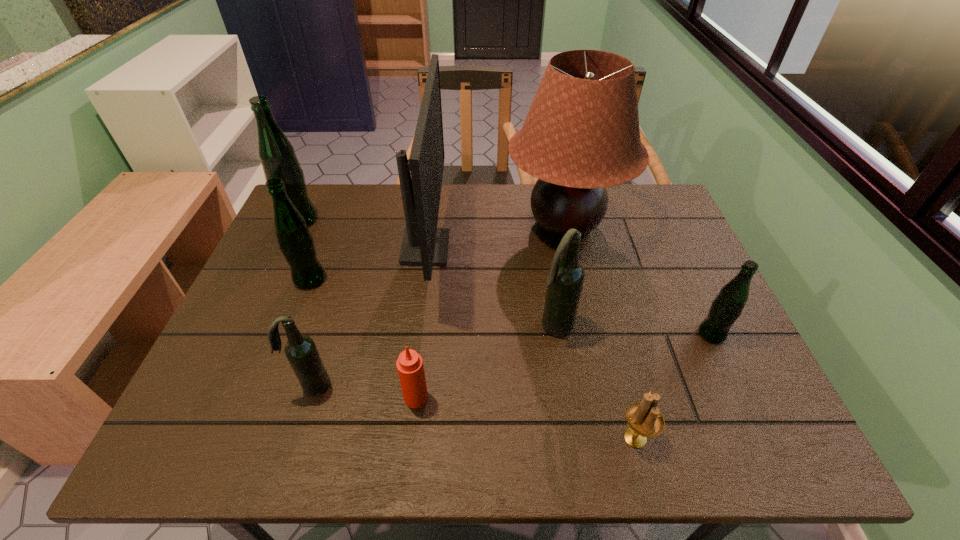
Locate an element on the screen. This screenshot has width=960, height=540. free space between the nearest object and the rightmost beer bottle is located at coordinates (673, 386).

Where is `free space between the fourth beer bottle from left to right and the nearest object`? The height and width of the screenshot is (540, 960). free space between the fourth beer bottle from left to right and the nearest object is located at coordinates (595, 382).

The image size is (960, 540). Identify the location of vacant point located between the nearest object and the brown lampshade. (600, 331).

This screenshot has width=960, height=540. I want to click on free space between the seventh object from right to left and the smallest green beer bottle, so click(512, 359).

Locate an element on the screen. vacant area between the rightmost beer bottle and the lampshade is located at coordinates (638, 280).

I want to click on object that is the fourth closest to the computer monitor, so click(x=296, y=243).

Locate an element on the screen. the seventh closest object to the second beer bottle from left to right is located at coordinates (644, 419).

The width and height of the screenshot is (960, 540). I want to click on beer bottle that stands as the closest to the smaller dark beer bottle, so click(296, 243).

This screenshot has width=960, height=540. What are the coordinates of `the closest beer bottle relative to the computer monitor` in the screenshot? It's located at (301, 351).

This screenshot has width=960, height=540. Find the location of `green beer bottle that can be found as the closest to the rightmost green beer bottle`. green beer bottle that can be found as the closest to the rightmost green beer bottle is located at coordinates (296, 243).